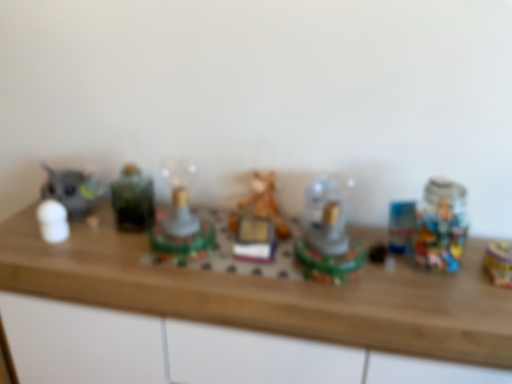
Question: From the image's perspective, would you say wooden counter top at center is shown under white matte figurine at left, the seventh toy in the right-to-left sequence?

Choices:
 (A) no
 (B) yes

Answer: (B)

Question: Considering the relative positions of wooden counter top at center and white matte figurine at left, the seventh toy in the right-to-left sequence, in the image provided, is wooden counter top at center to the right of white matte figurine at left, the seventh toy in the right-to-left sequence, from the viewer's perspective?

Choices:
 (A) yes
 (B) no

Answer: (A)

Question: Would you say wooden counter top at center is outside white matte figurine at left, the seventh toy in the right-to-left sequence?

Choices:
 (A) yes
 (B) no

Answer: (A)

Question: Considering the relative sizes of wooden counter top at center and white matte figurine at left, the first toy positioned from the left, in the image provided, is wooden counter top at center shorter than white matte figurine at left, the first toy positioned from the left,?

Choices:
 (A) no
 (B) yes

Answer: (A)

Question: Is wooden counter top at center aimed at white matte figurine at left, the first toy positioned from the left?

Choices:
 (A) yes
 (B) no

Answer: (B)

Question: From a real-world perspective, is wooden counter top at center below white matte figurine at left, the first toy positioned from the left?

Choices:
 (A) no
 (B) yes

Answer: (B)

Question: Is gold metallic toy at right, the 7th toy positioned from the left, smaller than white matte figurine at left, the first toy positioned from the left?

Choices:
 (A) yes
 (B) no

Answer: (A)

Question: From the image's perspective, would you say gold metallic toy at right, the 7th toy positioned from the left, is shown under white matte figurine at left, the seventh toy in the right-to-left sequence?

Choices:
 (A) yes
 (B) no

Answer: (A)

Question: Is gold metallic toy at right, which ranks as the 1th toy in right-to-left order, in contact with white matte figurine at left, the first toy positioned from the left?

Choices:
 (A) yes
 (B) no

Answer: (B)

Question: Does gold metallic toy at right, the 7th toy positioned from the left, have a lesser width compared to white matte figurine at left, the seventh toy in the right-to-left sequence?

Choices:
 (A) no
 (B) yes

Answer: (A)

Question: Can you confirm if gold metallic toy at right, the 7th toy positioned from the left, is wider than white matte figurine at left, the seventh toy in the right-to-left sequence?

Choices:
 (A) no
 (B) yes

Answer: (B)

Question: Would you say gold metallic toy at right, the 7th toy positioned from the left, contains white matte figurine at left, the seventh toy in the right-to-left sequence?

Choices:
 (A) yes
 (B) no

Answer: (B)

Question: Can you confirm if translucent plastic toy at center, which is counted as the sixth toy, starting from the left, is shorter than white matte figurine at left, the first toy positioned from the left?

Choices:
 (A) no
 (B) yes

Answer: (A)